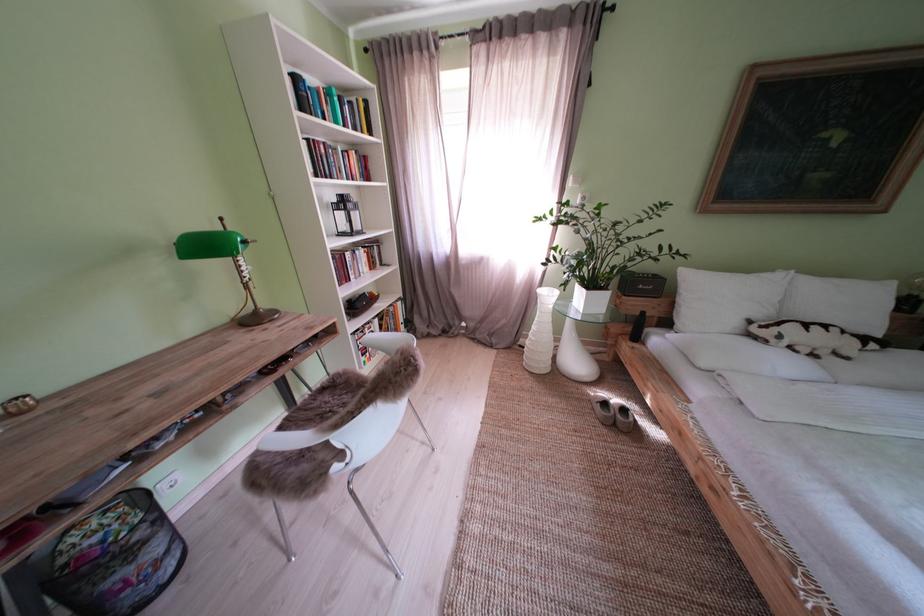
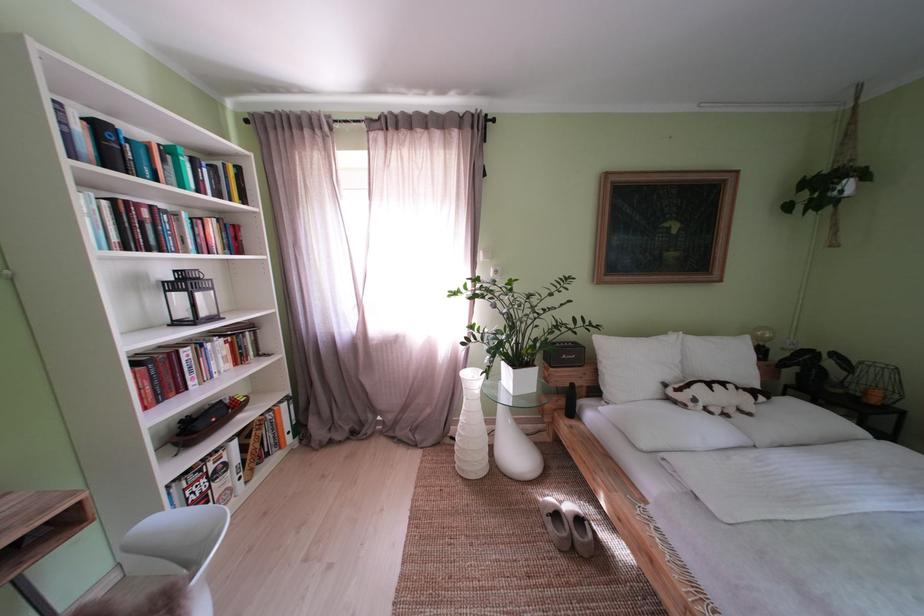
Question: I am providing you with two images of the same scene from different viewpoints. Please identify which objects are invisible in image2.

Choices:
 (A) stuffed animal toy
 (B) slipper
 (C) white chair sitting surface
 (D) none of these

Answer: (D)